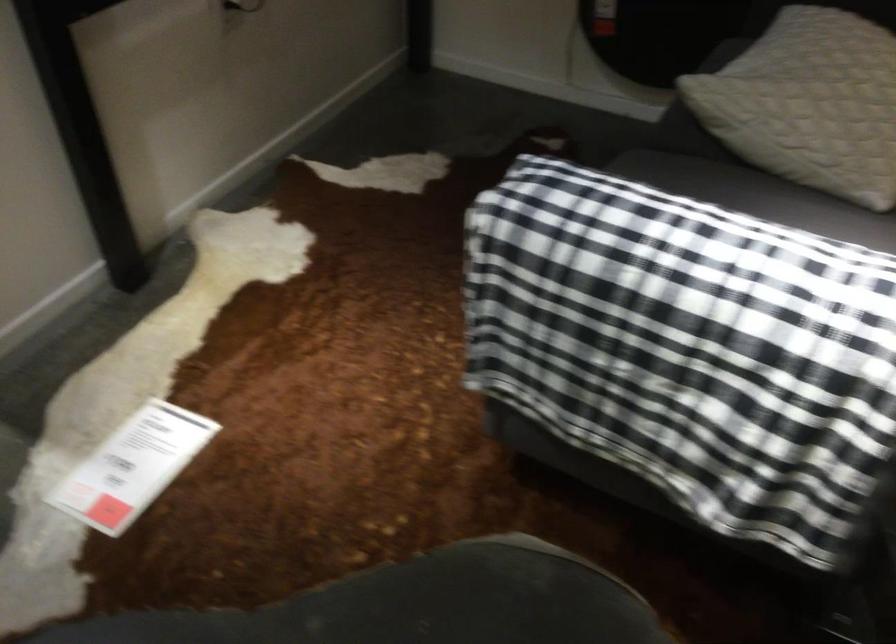
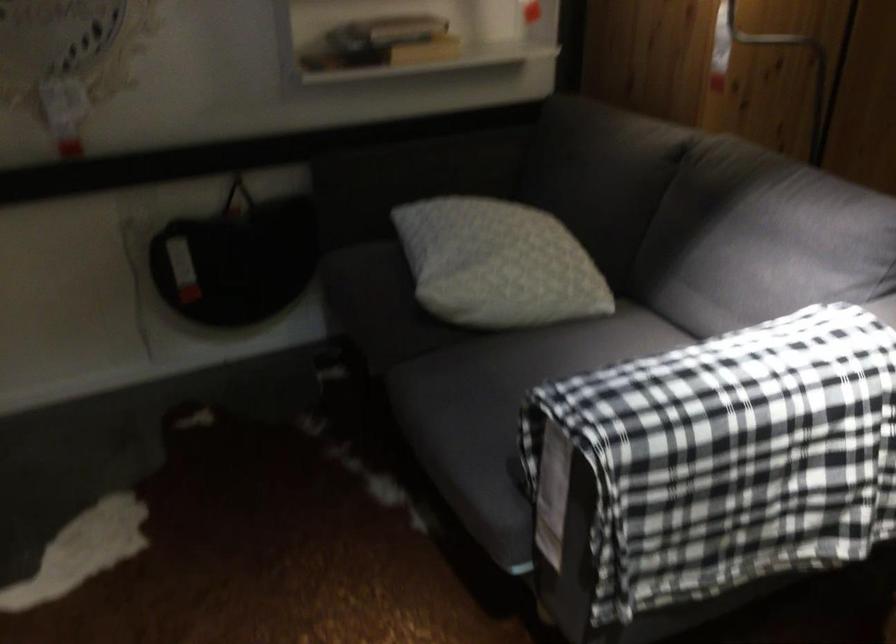
Question: The camera is either moving clockwise (left) or counter-clockwise (right) around the object. The first image is from the beginning of the video and the second image is from the end. Is the camera moving left or right when shooting the video?

Choices:
 (A) Left
 (B) Right

Answer: (A)